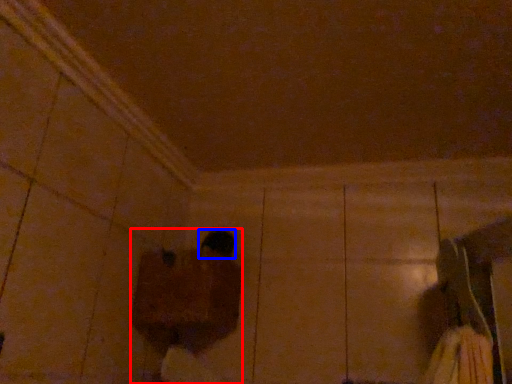
Question: Among these objects, which one is nearest to the camera, person (highlighted by a red box) or footwear (highlighted by a blue box)?

Choices:
 (A) person
 (B) footwear

Answer: (A)